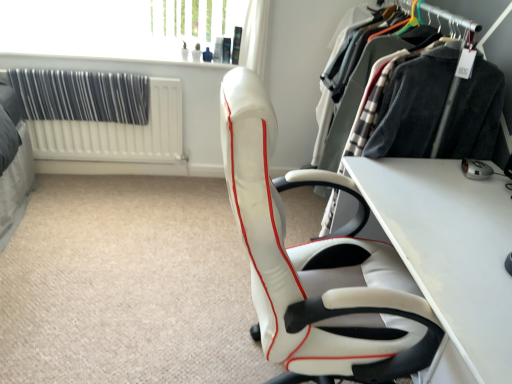
Identify the location of vacant area that is in front of silver metallic mouse at lower right. (483, 193).